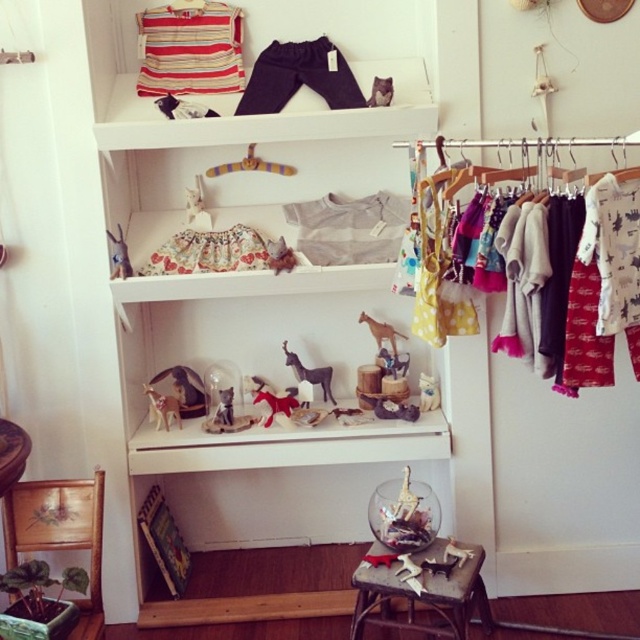
Question: Which of these objects is positioned farthest from the metallic stool at lower center?

Choices:
 (A) white cotton shirt at center
 (B) fluffy fabric dress at center
 (C) matte wooden toy at middle

Answer: (B)

Question: Is dark blue cotton pants at upper center below wooden toy at center?

Choices:
 (A) no
 (B) yes

Answer: (A)

Question: Is striped cotton shirt at upper left positioned at the back of matte white figurine at center?

Choices:
 (A) no
 (B) yes

Answer: (A)

Question: Which of these objects is positioned farthest from the wooden giraffe at center?

Choices:
 (A) wooden toy at center
 (B) metallic stool at lower center
 (C) matte white figurine at center

Answer: (C)

Question: Is velvet plush horse at center smaller than matte gray deer at center?

Choices:
 (A) yes
 (B) no

Answer: (B)

Question: Which of the following is the farthest from the observer?

Choices:
 (A) dark blue cotton pants at upper center
 (B) matte floral skirt at center

Answer: (A)